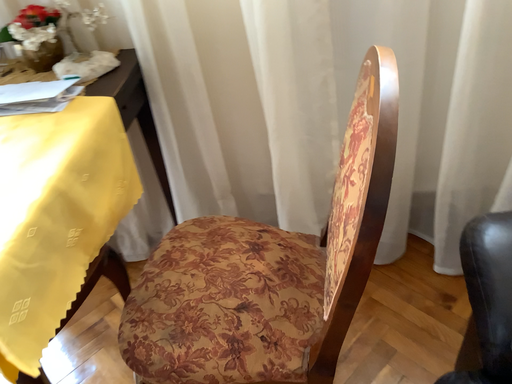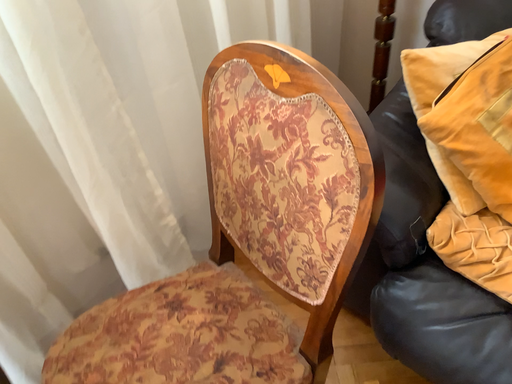
Question: How did the camera likely rotate when shooting the video?

Choices:
 (A) rotated left
 (B) rotated right

Answer: (B)